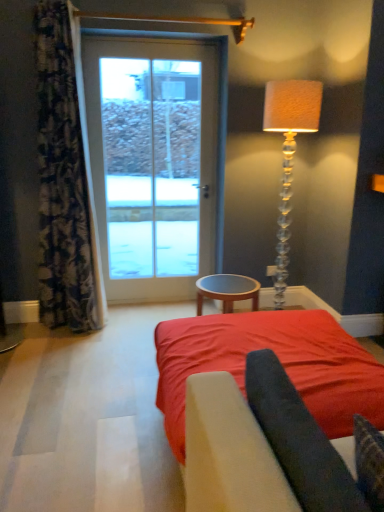
Locate an element on the screen. The width and height of the screenshot is (384, 512). blank space situated above white glass door at center (from a real-world perspective) is located at coordinates (152, 39).